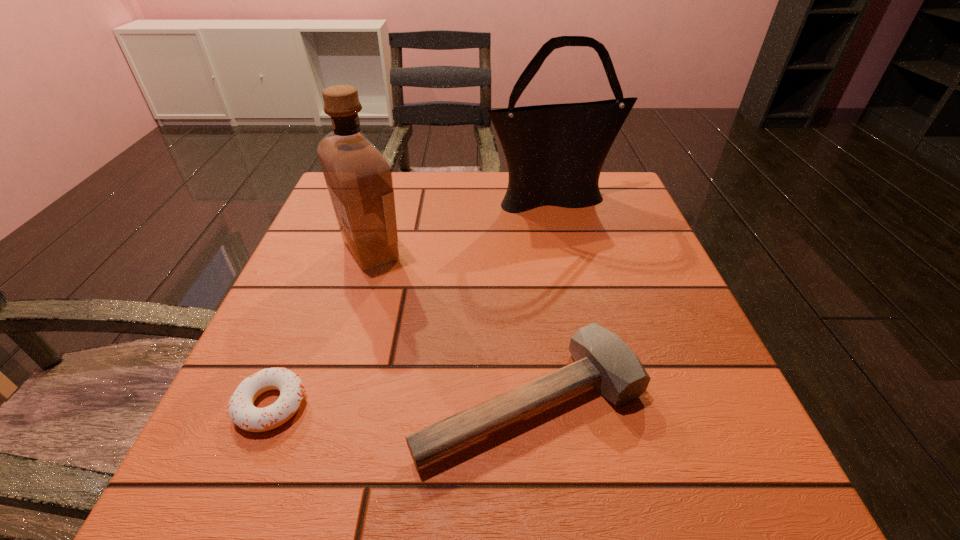
Where is `blank space at the near left corner`? The height and width of the screenshot is (540, 960). blank space at the near left corner is located at coordinates (291, 472).

Identify the location of free point at the far right corner. The width and height of the screenshot is (960, 540). (590, 206).

The width and height of the screenshot is (960, 540). In order to click on free region at the near right corner of the desktop in this screenshot , I will do `click(673, 475)`.

Locate an element on the screen. This screenshot has width=960, height=540. free space between the third tallest object and the farthest object is located at coordinates (542, 300).

The image size is (960, 540). I want to click on vacant area between the mallet and the liquor, so click(x=450, y=326).

Find the location of `free area in between the second farthest object and the shortest object`. free area in between the second farthest object and the shortest object is located at coordinates (321, 328).

Locate an element on the screen. This screenshot has width=960, height=540. unoccupied area between the liquor and the doughnut is located at coordinates (321, 328).

You are a GUI agent. You are given a task and a screenshot of the screen. Output one action in this format:
    pyautogui.click(x=<x>, y=<y>)
    Task: Click on the free space between the farthest object and the mallet
    The width and height of the screenshot is (960, 540).
    Given the screenshot: What is the action you would take?
    pyautogui.click(x=542, y=300)

Identify the location of vacant space that's between the farthest object and the third tallest object. The image size is (960, 540). (542, 300).

You are a GUI agent. You are given a task and a screenshot of the screen. Output one action in this format:
    pyautogui.click(x=<x>, y=<y>)
    Task: Click on the free space between the mallet and the farthest object
    This screenshot has width=960, height=540.
    Given the screenshot: What is the action you would take?
    pyautogui.click(x=542, y=300)